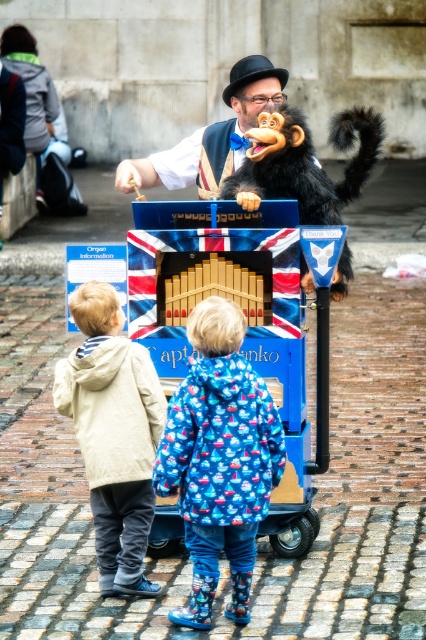
You are a performer standing at the light beige jacket at lower left position, and you need to reach the union jack painted organ at center to start the show. Considering your average walking speed is 3 feet per second, how many seconds will it take you to reach the organ?

The distance between the light beige jacket at lower left and the union jack painted organ at center is 11.93 feet. At a speed of 3 feet per second, dividing the distance by speed gives approximately 3.98 seconds, which rounds to about 4 seconds to reach the organ.

You are a street performer who needs to carry both the blue painted wooden organ at center and the blue printed coat at center to your next show. Which item should you carry first if you want to carry the larger item first?

You should carry the blue painted wooden organ at center first since it is bigger than the blue printed coat at center.

You are a tailor who needs to determine which item requires more fabric to make between the blue printed coat at center and the union jack painted organ at center. Based on the scene, which one would need more fabric?

The union jack painted organ at center requires more fabric because it is larger in size than the blue printed coat at center.